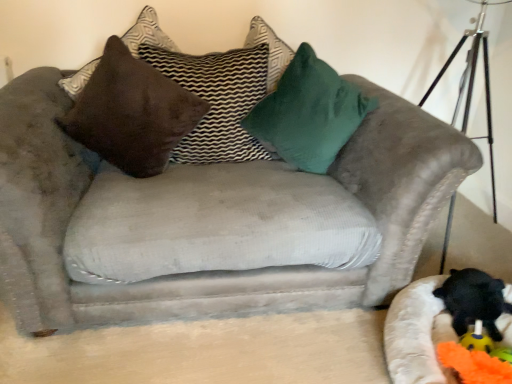
Where is `brown suede pillow at upper center, which is the second pillow from right to left`? The height and width of the screenshot is (384, 512). brown suede pillow at upper center, which is the second pillow from right to left is located at coordinates (217, 100).

The image size is (512, 384). What do you see at coordinates (217, 100) in the screenshot?
I see `brown suede pillow at upper center, which is the second pillow from right to left` at bounding box center [217, 100].

This screenshot has width=512, height=384. I want to click on beige fabric cat bed at lower right, so click(x=417, y=334).

Locate an element on the screen. The image size is (512, 384). orange fabric toy at lower right is located at coordinates (463, 354).

Looking at the image, does brown suede pillow at upper center, the second pillow in the left-to-right sequence, seem bigger or smaller compared to brown suede pillow at upper left, the third pillow from the right?

Clearly, brown suede pillow at upper center, the second pillow in the left-to-right sequence, is smaller in size than brown suede pillow at upper left, the third pillow from the right.

Is brown suede pillow at upper center, which is the second pillow from right to left, turned away from brown suede pillow at upper left, the first pillow viewed from the left?

Yes, brown suede pillow at upper center, which is the second pillow from right to left, is positioned with its back facing brown suede pillow at upper left, the first pillow viewed from the left.

How far apart are brown suede pillow at upper center, the second pillow in the left-to-right sequence, and brown suede pillow at upper left, the first pillow viewed from the left?

The distance of brown suede pillow at upper center, the second pillow in the left-to-right sequence, from brown suede pillow at upper left, the first pillow viewed from the left, is 6.89 inches.

Considering the positions of point (238, 87) and point (147, 99), is point (238, 87) closer or farther from the camera than point (147, 99)?

Point (238, 87) is farther from the camera than point (147, 99).

Is orange fabric toy at lower right at the right side of green velvet pillow at upper center, marked as the third pillow in a left-to-right arrangement?

Yes.

From a real-world perspective, is orange fabric toy at lower right above or below green velvet pillow at upper center, the 1th pillow positioned from the right?

orange fabric toy at lower right is situated lower than green velvet pillow at upper center, the 1th pillow positioned from the right, in the real world.

From the image's perspective, who appears lower, orange fabric toy at lower right or green velvet pillow at upper center, the 1th pillow positioned from the right?

orange fabric toy at lower right is shown below in the image.

This screenshot has height=384, width=512. In order to click on toy below the green velvet pillow at upper center, marked as the third pillow in a left-to-right arrangement (from a real-world perspective) in this screenshot , I will do coord(463,354).

From the image's perspective, which is below, beige fabric cat bed at lower right or orange fabric toy at lower right?

orange fabric toy at lower right appears lower in the image.

Is beige fabric cat bed at lower right facing away from orange fabric toy at lower right?

No, beige fabric cat bed at lower right is not facing the opposite direction of orange fabric toy at lower right.

From a real-world perspective, is beige fabric cat bed at lower right on top of orange fabric toy at lower right?

No, from a real-world perspective, beige fabric cat bed at lower right is not above orange fabric toy at lower right.

Is brown suede pillow at upper center, which is the second pillow from right to left, inside the boundaries of black plush toy at lower right, or outside?

brown suede pillow at upper center, which is the second pillow from right to left, is spatially situated outside black plush toy at lower right.

Which point is more forward, (218,75) or (488,290)?

Point (488,290)

Can you confirm if brown suede pillow at upper center, which is the second pillow from right to left, is taller than black plush toy at lower right?

Indeed, brown suede pillow at upper center, which is the second pillow from right to left, has a greater height compared to black plush toy at lower right.

Where is `cat bed below the orange fabric toy at lower right (from a real-world perspective)`? cat bed below the orange fabric toy at lower right (from a real-world perspective) is located at coordinates (417, 334).

Which of these two, orange fabric toy at lower right or beige fabric cat bed at lower right, stands shorter?

orange fabric toy at lower right is shorter.

Is green velvet pillow at upper center, marked as the third pillow in a left-to-right arrangement, next to brown suede pillow at upper center, which is the second pillow from right to left?

No.

Does green velvet pillow at upper center, marked as the third pillow in a left-to-right arrangement, contain brown suede pillow at upper center, which is the second pillow from right to left?

No, green velvet pillow at upper center, marked as the third pillow in a left-to-right arrangement, does not contain brown suede pillow at upper center, which is the second pillow from right to left.

Which object is further away from the camera taking this photo, green velvet pillow at upper center, marked as the third pillow in a left-to-right arrangement, or brown suede pillow at upper center, the second pillow in the left-to-right sequence?

Positioned behind is brown suede pillow at upper center, the second pillow in the left-to-right sequence.

Is green velvet pillow at upper center, the 1th pillow positioned from the right, taller or shorter than brown suede pillow at upper center, the second pillow in the left-to-right sequence?

Considering their sizes, green velvet pillow at upper center, the 1th pillow positioned from the right, has less height than brown suede pillow at upper center, the second pillow in the left-to-right sequence.

Can you see beige fabric cat bed at lower right touching black plush toy at lower right?

beige fabric cat bed at lower right and black plush toy at lower right are clearly separated.

Considering the positions of objects beige fabric cat bed at lower right and black plush toy at lower right in the image provided, who is behind, beige fabric cat bed at lower right or black plush toy at lower right?

Positioned behind is black plush toy at lower right.

Considering the sizes of objects beige fabric cat bed at lower right and black plush toy at lower right in the image provided, who is shorter, beige fabric cat bed at lower right or black plush toy at lower right?

black plush toy at lower right.

Between point (428, 332) and point (465, 283), which one is positioned in front?

The point (428, 332) is in front.

From a real-world perspective, starting from the brown suede pillow at upper center, the second pillow in the left-to-right sequence, which pillow is the 2nd one vertically above it? Please provide its 2D coordinates.

[(131, 113)]

Find the location of a particular element. The height and width of the screenshot is (384, 512). toy in front of the green velvet pillow at upper center, marked as the third pillow in a left-to-right arrangement is located at coordinates (463, 354).

Estimate the real-world distances between objects in this image. Which object is closer to brown suede pillow at upper center, which is the second pillow from right to left, green velvet pillow at upper center, marked as the third pillow in a left-to-right arrangement, or orange fabric toy at lower right?

green velvet pillow at upper center, marked as the third pillow in a left-to-right arrangement, is closer to brown suede pillow at upper center, which is the second pillow from right to left.

Estimate the real-world distances between objects in this image. Which object is closer to beige fabric cat bed at lower right, orange fabric toy at lower right or brown suede pillow at upper center, the second pillow in the left-to-right sequence?

orange fabric toy at lower right is closer to beige fabric cat bed at lower right.

Looking at the image, which one is located closer to black plush toy at lower right, green velvet pillow at upper center, marked as the third pillow in a left-to-right arrangement, or orange fabric toy at lower right?

orange fabric toy at lower right.

When comparing their distances from brown suede pillow at upper center, the second pillow in the left-to-right sequence, does orange fabric toy at lower right or brown suede pillow at upper left, the first pillow viewed from the left, seem further?

The object further to brown suede pillow at upper center, the second pillow in the left-to-right sequence, is orange fabric toy at lower right.

Based on their spatial positions, is brown suede pillow at upper left, the third pillow from the right, or beige fabric cat bed at lower right closer to black plush toy at lower right?

beige fabric cat bed at lower right.

Based on their spatial positions, is black plush toy at lower right or beige fabric cat bed at lower right closer to brown suede pillow at upper center, which is the second pillow from right to left?

→ beige fabric cat bed at lower right is positioned closer to the anchor brown suede pillow at upper center, which is the second pillow from right to left.

Consider the image. Considering their positions, is brown suede pillow at upper center, which is the second pillow from right to left, positioned further to black plush toy at lower right than brown suede pillow at upper left, the third pillow from the right?

brown suede pillow at upper left, the third pillow from the right, is positioned further to the anchor black plush toy at lower right.

Considering their positions, is black plush toy at lower right positioned closer to brown suede pillow at upper left, the third pillow from the right, than beige fabric cat bed at lower right?

Based on the image, beige fabric cat bed at lower right appears to be nearer to brown suede pillow at upper left, the third pillow from the right.

The width and height of the screenshot is (512, 384). Find the location of `cat bed located between brown suede pillow at upper center, which is the second pillow from right to left, and black plush toy at lower right in the left-right direction`. cat bed located between brown suede pillow at upper center, which is the second pillow from right to left, and black plush toy at lower right in the left-right direction is located at coordinates (417, 334).

Locate an element on the screen. pillow situated between brown suede pillow at upper left, the third pillow from the right, and green velvet pillow at upper center, marked as the third pillow in a left-to-right arrangement, from left to right is located at coordinates (217, 100).

The height and width of the screenshot is (384, 512). I want to click on toy between beige fabric cat bed at lower right and black plush toy at lower right from front to back, so click(463, 354).

This screenshot has height=384, width=512. Find the location of `pillow that lies between brown suede pillow at upper center, the second pillow in the left-to-right sequence, and orange fabric toy at lower right from top to bottom`. pillow that lies between brown suede pillow at upper center, the second pillow in the left-to-right sequence, and orange fabric toy at lower right from top to bottom is located at coordinates (308, 113).